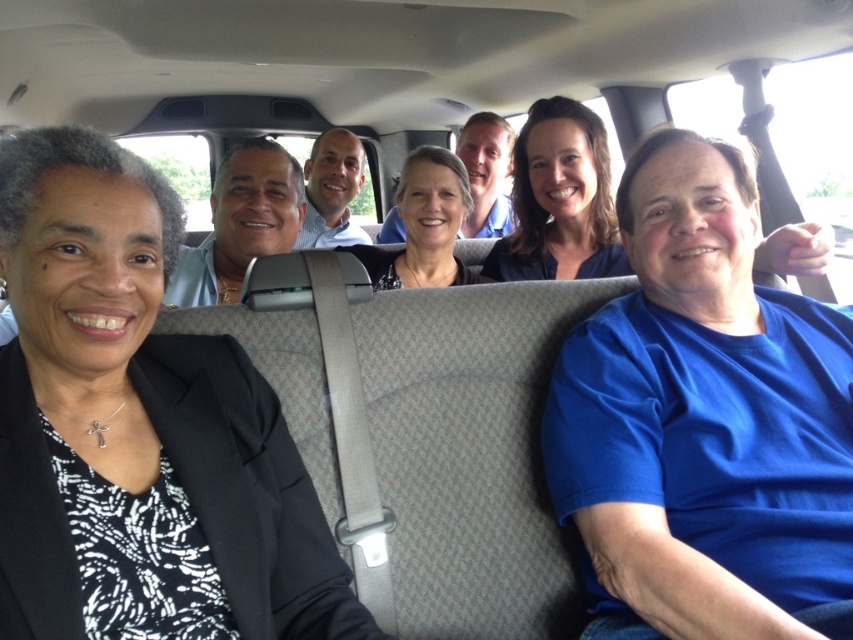
Is black matte blazer at left shorter than matte blue shirt at center?

Incorrect, black matte blazer at left's height does not fall short of matte blue shirt at center's.

Identify the location of black matte blazer at left. (138, 429).

How far apart are matte blue shirt at center and matte black hair at center?

They are 9.91 inches apart.

Is matte blue shirt at center above matte black hair at center?

Indeed, matte blue shirt at center is positioned over matte black hair at center.

Is point (583, 253) in front of point (434, 225)?

Yes, it is.

In order to click on matte blue shirt at center in this screenshot , I will do `click(560, 198)`.

Is black matte blazer at left wider than matte black hair at center?

Yes.

Does black matte blazer at left come behind matte black hair at center?

No.

What do you see at coordinates (138, 429) in the screenshot? I see `black matte blazer at left` at bounding box center [138, 429].

This screenshot has height=640, width=853. I want to click on black matte blazer at left, so click(x=138, y=429).